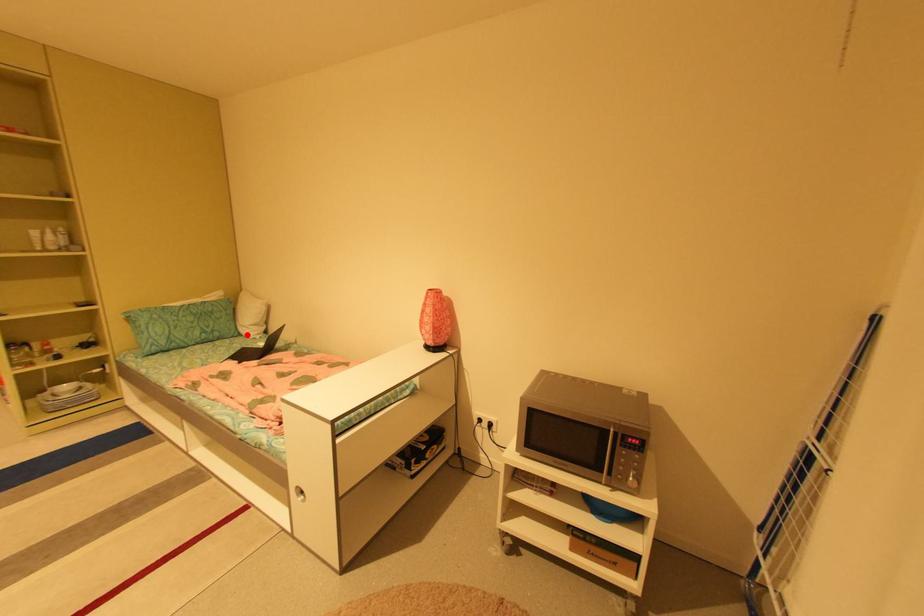
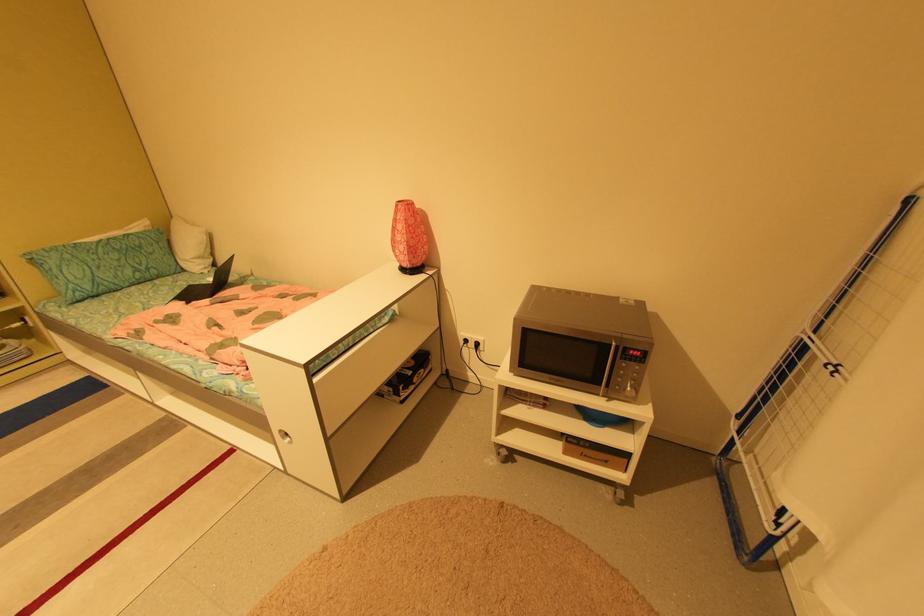
Locate, in the second image, the point that corresponds to the highlighted location in the first image.

(190, 270)